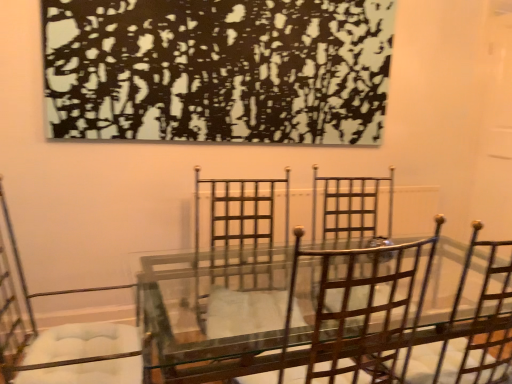
Measure the distance between point (7, 302) and camera.

Point (7, 302) and camera are 7.44 feet apart from each other.

Where is `black textured painting at upper center`? The image size is (512, 384). black textured painting at upper center is located at coordinates (218, 70).

What is the approximate width of metallic brown chair at center, which is the first chair in right-to-left order?

The width of metallic brown chair at center, which is the first chair in right-to-left order, is 20.61 inches.

You are a GUI agent. You are given a task and a screenshot of the screen. Output one action in this format:
    pyautogui.click(x=<x>, y=<y>)
    Task: Click on the metallic brown chair at center, which is the first chair in right-to-left order
    Image resolution: width=512 pixels, height=384 pixels.
    Given the screenshot: What is the action you would take?
    pyautogui.click(x=365, y=307)

Identify the location of metallic silver chair at left, the 2th chair from the right. The height and width of the screenshot is (384, 512). (29, 312).

Who is taller, black textured painting at upper center or metallic brown chair at center, which is the first chair in right-to-left order?

black textured painting at upper center.

From the picture: How distant is black textured painting at upper center from metallic brown chair at center, the 2th chair positioned from the left?

A distance of 4.52 feet exists between black textured painting at upper center and metallic brown chair at center, the 2th chair positioned from the left.

Is black textured painting at upper center positioned far away from metallic brown chair at center, which is the first chair in right-to-left order?

black textured painting at upper center is far away from metallic brown chair at center, which is the first chair in right-to-left order.

Which object is closer to the camera taking this photo, black textured painting at upper center or metallic brown chair at center, which is the first chair in right-to-left order?

metallic brown chair at center, which is the first chair in right-to-left order.

Between metallic brown chair at center, the 2th chair positioned from the left, and black textured painting at upper center, which one has larger size?

black textured painting at upper center.

Which is more to the right, metallic brown chair at center, which is the first chair in right-to-left order, or black textured painting at upper center?

metallic brown chair at center, which is the first chair in right-to-left order.

From the image's perspective, which one is positioned higher, metallic brown chair at center, which is the first chair in right-to-left order, or black textured painting at upper center?

black textured painting at upper center.

Based on the photo, is black textured painting at upper center surrounded by metallic brown chair at center, which is the first chair in right-to-left order?

No, black textured painting at upper center is not surrounded by metallic brown chair at center, which is the first chair in right-to-left order.

From the image's perspective, is black textured painting at upper center on metallic silver chair at left, arranged as the first chair when viewed from the left?

Yes, from the image's perspective, black textured painting at upper center is over metallic silver chair at left, arranged as the first chair when viewed from the left.

Which is behind, point (273, 88) or point (1, 366)?

The point (273, 88) is farther.

Is black textured painting at upper center turned away from metallic silver chair at left, arranged as the first chair when viewed from the left?

No.

From a real-world perspective, is metallic silver chair at left, the 2th chair from the right, positioned under metallic brown chair at center, the 2th chair positioned from the left, based on gravity?

Yes, from a real-world perspective, metallic silver chair at left, the 2th chair from the right, is below metallic brown chair at center, the 2th chair positioned from the left.

Considering the sizes of metallic silver chair at left, the 2th chair from the right, and metallic brown chair at center, which is the first chair in right-to-left order, in the image, is metallic silver chair at left, the 2th chair from the right, bigger or smaller than metallic brown chair at center, which is the first chair in right-to-left order,?

metallic silver chair at left, the 2th chair from the right, is bigger than metallic brown chair at center, which is the first chair in right-to-left order.

Consider the image. Considering the sizes of metallic silver chair at left, arranged as the first chair when viewed from the left, and metallic brown chair at center, which is the first chair in right-to-left order, in the image, is metallic silver chair at left, arranged as the first chair when viewed from the left, taller or shorter than metallic brown chair at center, which is the first chair in right-to-left order,?

Considering their sizes, metallic silver chair at left, arranged as the first chair when viewed from the left, has more height than metallic brown chair at center, which is the first chair in right-to-left order.

Is metallic silver chair at left, arranged as the first chair when viewed from the left, positioned in front of metallic brown chair at center, the 2th chair positioned from the left?

No, metallic silver chair at left, arranged as the first chair when viewed from the left, is behind metallic brown chair at center, the 2th chair positioned from the left.

Which of these two, metallic silver chair at left, arranged as the first chair when viewed from the left, or black textured painting at upper center, stands taller?

With more height is metallic silver chair at left, arranged as the first chair when viewed from the left.

Consider the image. From a real-world perspective, is metallic silver chair at left, arranged as the first chair when viewed from the left, beneath black textured painting at upper center?

Indeed, from a real-world perspective, metallic silver chair at left, arranged as the first chair when viewed from the left, is positioned beneath black textured painting at upper center.

Does point (26, 297) come closer to viewer compared to point (89, 85)?

No, (26, 297) is further to viewer.

Which is in front, metallic silver chair at left, arranged as the first chair when viewed from the left, or black textured painting at upper center?

metallic silver chair at left, arranged as the first chair when viewed from the left.

Which is nearer, [364,255] or [10,290]?

Answer: Point [364,255]

From the image's perspective, relative to metallic silver chair at left, arranged as the first chair when viewed from the left, is metallic brown chair at center, which is the first chair in right-to-left order, above or below?

Based on their image positions, metallic brown chair at center, which is the first chair in right-to-left order, is located above metallic silver chair at left, arranged as the first chair when viewed from the left.

Locate an element on the screen. Image resolution: width=512 pixels, height=384 pixels. the 1st chair positioned below the black textured painting at upper center (from the image's perspective) is located at coordinates (365, 307).

Where is `chair on the right side of black textured painting at upper center`? The width and height of the screenshot is (512, 384). chair on the right side of black textured painting at upper center is located at coordinates (365, 307).

Considering their positions, is metallic silver chair at left, arranged as the first chair when viewed from the left, positioned further to metallic brown chair at center, which is the first chair in right-to-left order, than black textured painting at upper center?

metallic silver chair at left, arranged as the first chair when viewed from the left, lies further to metallic brown chair at center, which is the first chair in right-to-left order, than the other object.

Considering their positions, is black textured painting at upper center positioned further to metallic silver chair at left, arranged as the first chair when viewed from the left, than metallic brown chair at center, which is the first chair in right-to-left order?

Among the two, metallic brown chair at center, which is the first chair in right-to-left order, is located further to metallic silver chair at left, arranged as the first chair when viewed from the left.

Looking at the image, which one is located further to black textured painting at upper center, metallic silver chair at left, arranged as the first chair when viewed from the left, or metallic brown chair at center, which is the first chair in right-to-left order?

metallic brown chair at center, which is the first chair in right-to-left order.

Considering their positions, is metallic brown chair at center, which is the first chair in right-to-left order, positioned closer to black textured painting at upper center than metallic silver chair at left, arranged as the first chair when viewed from the left?

metallic silver chair at left, arranged as the first chair when viewed from the left, is closer to black textured painting at upper center.

Considering their positions, is metallic brown chair at center, which is the first chair in right-to-left order, positioned further to metallic silver chair at left, arranged as the first chair when viewed from the left, than black textured painting at upper center?

The object further to metallic silver chair at left, arranged as the first chair when viewed from the left, is metallic brown chair at center, which is the first chair in right-to-left order.

Considering their positions, is black textured painting at upper center positioned further to metallic brown chair at center, the 2th chair positioned from the left, than metallic silver chair at left, the 2th chair from the right?

metallic silver chair at left, the 2th chair from the right.

Where is `chair that lies between black textured painting at upper center and metallic silver chair at left, arranged as the first chair when viewed from the left, from top to bottom`? The image size is (512, 384). chair that lies between black textured painting at upper center and metallic silver chair at left, arranged as the first chair when viewed from the left, from top to bottom is located at coordinates (365, 307).